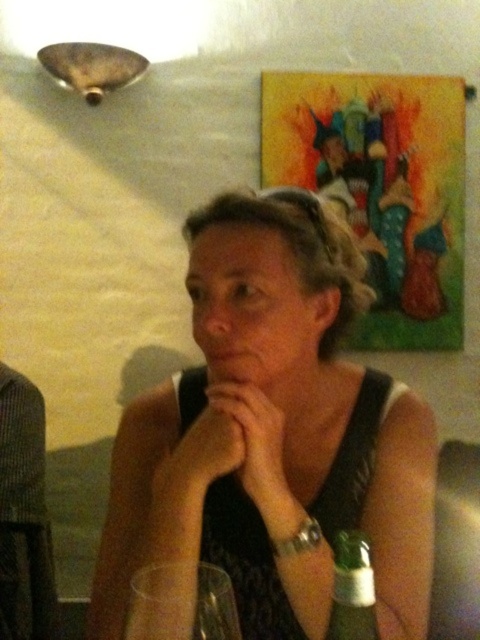
Question: Which object appears farthest from the camera in this image?

Choices:
 (A) matte black tank top at center
 (B) transparent plastic wine glass at lower center

Answer: (A)

Question: Which object appears farthest from the camera in this image?

Choices:
 (A) matte black tank top at center
 (B) green glass bottle at lower right

Answer: (A)

Question: From the image, what is the correct spatial relationship of transparent plastic wine glass at lower center in relation to green glass bottle at lower right?

Choices:
 (A) left
 (B) right

Answer: (A)

Question: Is matte black tank top at center thinner than transparent plastic wine glass at lower center?

Choices:
 (A) no
 (B) yes

Answer: (A)

Question: Does matte black tank top at center appear on the left side of green glass bottle at lower right?

Choices:
 (A) yes
 (B) no

Answer: (A)

Question: Which object is farther from the camera taking this photo?

Choices:
 (A) transparent plastic wine glass at lower center
 (B) green glass bottle at lower right
 (C) matte black tank top at center

Answer: (C)